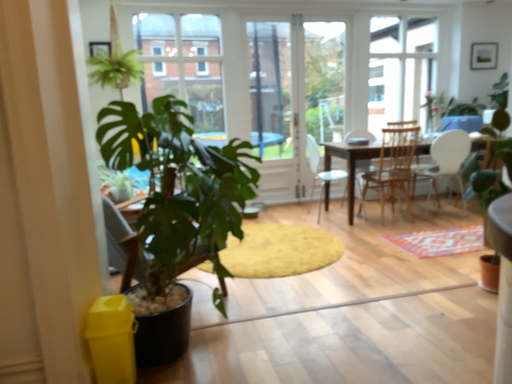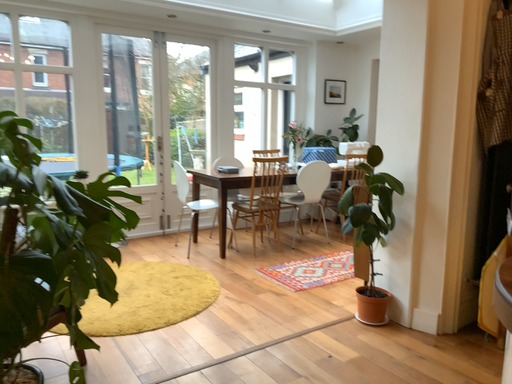
Question: How did the camera likely rotate when shooting the video?

Choices:
 (A) rotated left
 (B) rotated right

Answer: (B)